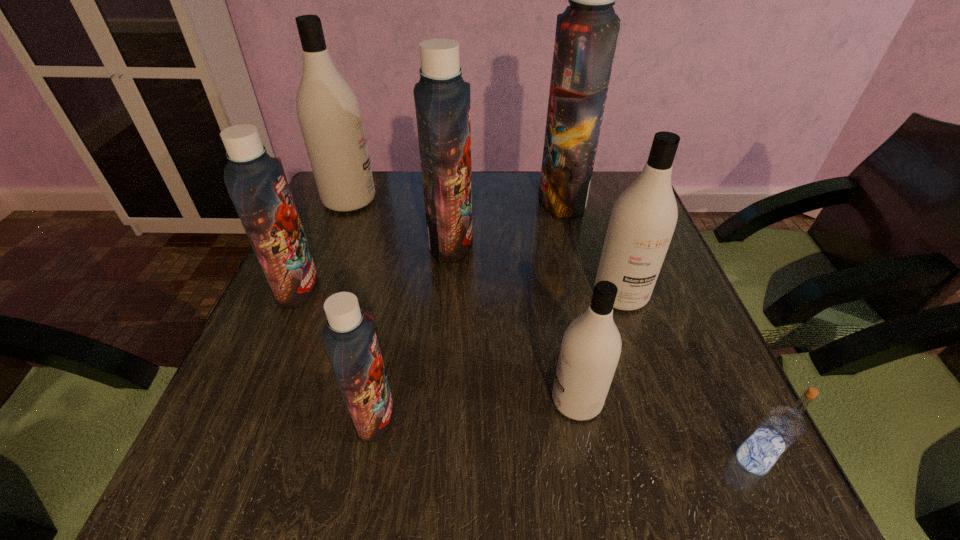
You are a GUI agent. You are given a task and a screenshot of the screen. Output one action in this format:
    pyautogui.click(x=<x>, y=<y>)
    Task: Click on the sixth object from right to left
    
    Given the screenshot: What is the action you would take?
    pyautogui.click(x=350, y=340)

At what (x,y) coordinates should I click in order to perform the action: click on the nearest white shampoo. Please return your answer as a coordinate pair (x, y). Looking at the image, I should click on pyautogui.click(x=590, y=349).

At what (x,y) coordinates should I click in order to perform the action: click on the second white shampoo from right to left. Please return your answer as a coordinate pair (x, y). The height and width of the screenshot is (540, 960). Looking at the image, I should click on (590, 349).

Identify the location of the rightmost object. (781, 427).

Locate an element on the screen. This screenshot has height=540, width=960. blue vodka is located at coordinates (781, 427).

Where is `vacant area located 0.160m on the front label of the rightmost blue shampoo`? The width and height of the screenshot is (960, 540). vacant area located 0.160m on the front label of the rightmost blue shampoo is located at coordinates (481, 199).

This screenshot has width=960, height=540. Identify the location of vacant region located on the front label of the rightmost blue shampoo. (427, 199).

Locate an element on the screen. This screenshot has height=540, width=960. vacant region located 0.280m on the front label of the rightmost blue shampoo is located at coordinates (438, 199).

Where is `vacant space positioned on the front-facing side of the farthest white shampoo`? vacant space positioned on the front-facing side of the farthest white shampoo is located at coordinates (442, 200).

The height and width of the screenshot is (540, 960). Identify the location of free spot located 0.290m on the front label of the fourth shampoo from right to left. (591, 242).